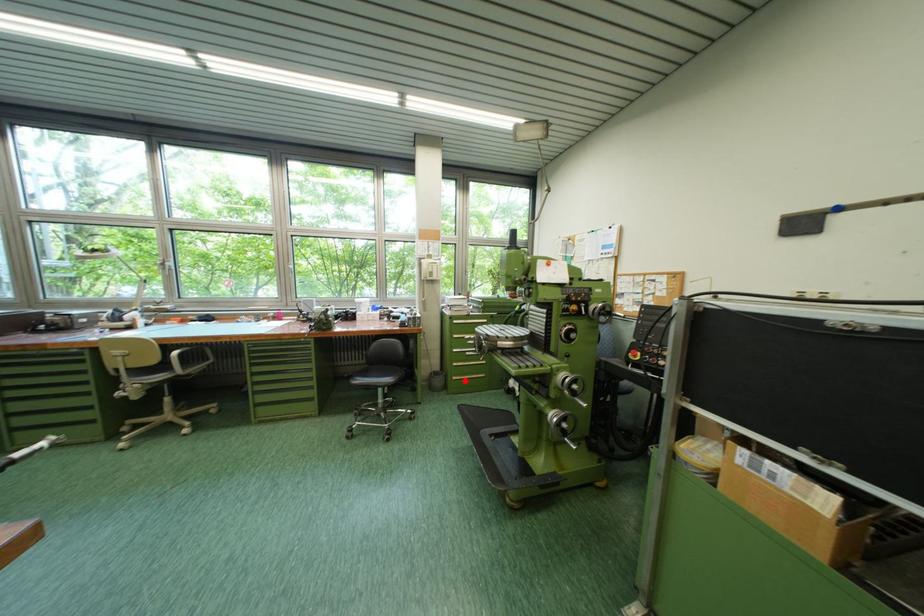
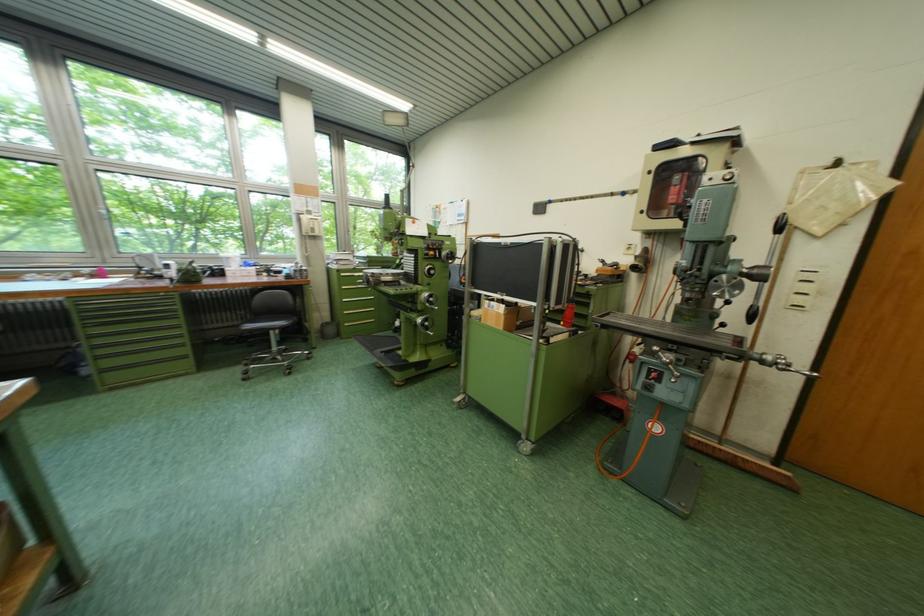
Question: I am providing you with two images of the same scene from different viewpoints. In image1, a red point is highlighted. Considering the same 3D point in image2, which of the following is correct?

Choices:
 (A) It is closer
 (B) It is farther

Answer: (A)